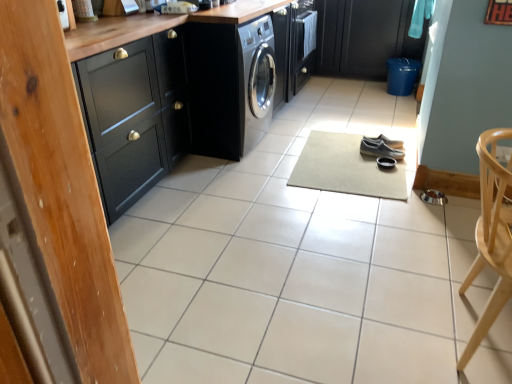
The height and width of the screenshot is (384, 512). Find the location of `free spot to the left of black leather shoes at center, marked as the 1th footwear in a back-to-front arrangement`. free spot to the left of black leather shoes at center, marked as the 1th footwear in a back-to-front arrangement is located at coordinates (350, 144).